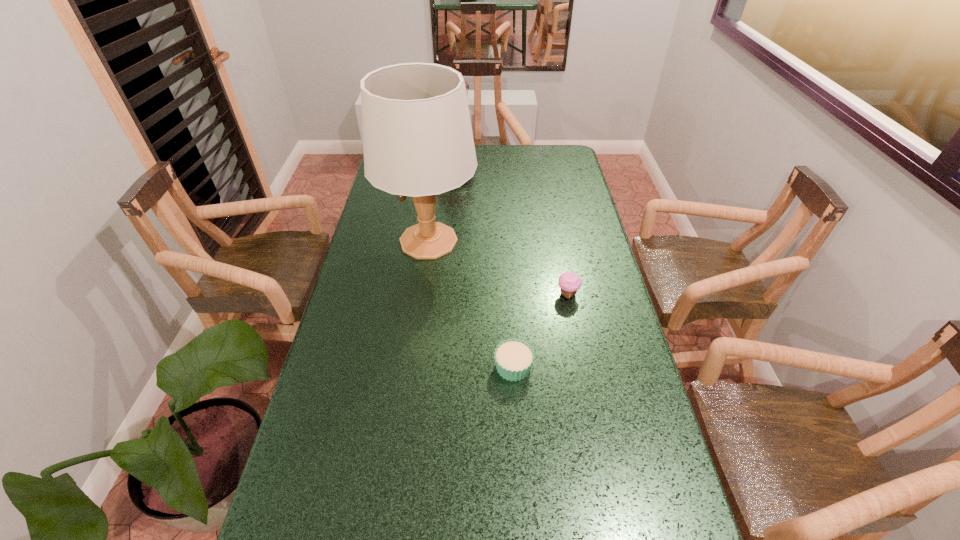
You are a GUI agent. You are given a task and a screenshot of the screen. Output one action in this format:
    pyautogui.click(x=<x>, y=<y>)
    Task: Click on the table lamp
    
    Given the screenshot: What is the action you would take?
    pyautogui.click(x=417, y=136)

In order to click on the second farthest object in this screenshot , I will do `click(417, 136)`.

This screenshot has height=540, width=960. I want to click on food processor, so click(x=466, y=85).

This screenshot has width=960, height=540. What are the coordinates of `the third shortest object` in the screenshot? It's located at tap(466, 85).

Locate an element on the screen. The width and height of the screenshot is (960, 540). the rightmost object is located at coordinates (569, 282).

This screenshot has height=540, width=960. I want to click on the right cupcake, so click(x=569, y=282).

Locate an element on the screen. This screenshot has height=540, width=960. the left cupcake is located at coordinates (513, 358).

Where is `the nearest object`? This screenshot has height=540, width=960. the nearest object is located at coordinates (513, 358).

This screenshot has width=960, height=540. In order to click on free space located on the left of the tallest object in this screenshot , I will do 360,241.

In order to click on vacant point located 0.250m on the controls of the third shortest object in this screenshot , I will do `click(533, 169)`.